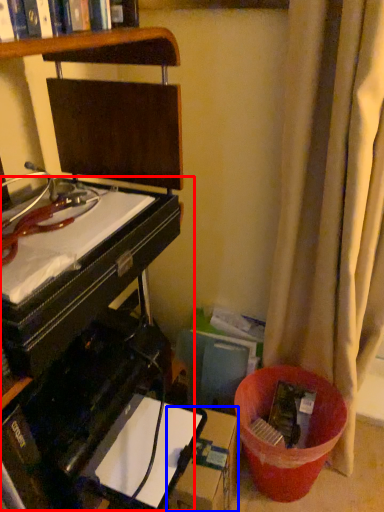
Question: Which point is closer to the camera, computer desk (highlighted by a red box) or cardboard box (highlighted by a blue box)?

Choices:
 (A) computer desk
 (B) cardboard box

Answer: (A)